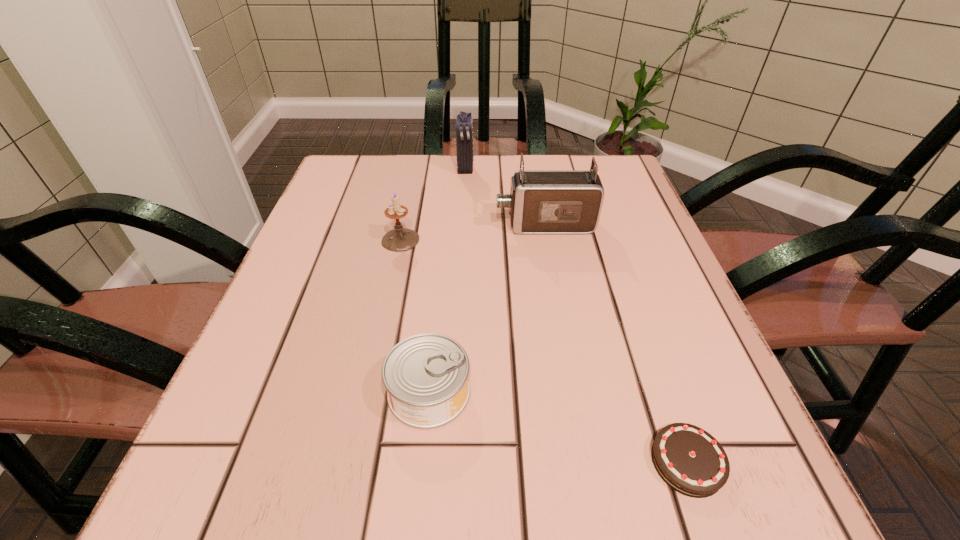
You are a GUI agent. You are given a task and a screenshot of the screen. Output one action in this format:
    pyautogui.click(x=<x>, y=<y>)
    Task: Click on the camcorder
    
    Given the screenshot: What is the action you would take?
    pyautogui.click(x=541, y=201)

Locate an element on the screen. clutch bag is located at coordinates (464, 130).

Locate an element on the screen. This screenshot has width=960, height=540. candle holder is located at coordinates coord(399,239).

The image size is (960, 540). I want to click on the fourth tallest object, so click(426, 375).

Find the location of a particular element. The height and width of the screenshot is (540, 960). chocolate cake is located at coordinates (691, 461).

I want to click on vacant space located at the lens of the camcorder, so click(x=388, y=225).

Where is `free location located at the lens of the camcorder`? This screenshot has height=540, width=960. free location located at the lens of the camcorder is located at coordinates (336, 225).

Find the location of a particular element. The height and width of the screenshot is (540, 960). vacant space located at the lens of the camcorder is located at coordinates (359, 225).

At what (x,y) coordinates should I click in order to perform the action: click on vacant space located 0.140m with the zip open on the clutch bag. Please return your answer as a coordinate pair (x, y). The height and width of the screenshot is (540, 960). Looking at the image, I should click on (464, 210).

Where is `free space located on the front of the third tallest object`? The height and width of the screenshot is (540, 960). free space located on the front of the third tallest object is located at coordinates (379, 339).